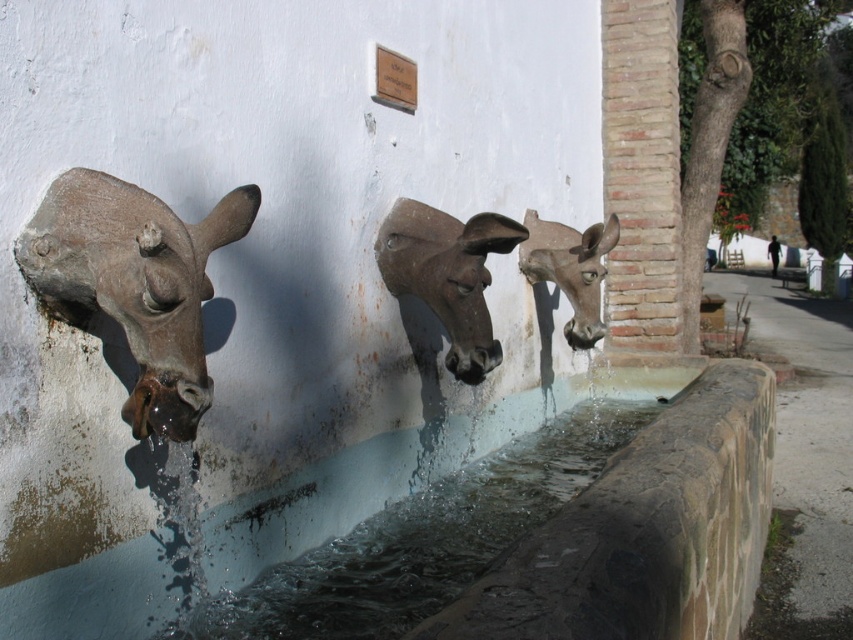
You are standing in front of the water fountain and want to touch both points on the wall. Which point, point [572,412] or point [26,282], will you reach first?

You will reach point [572,412] first because it is closer to you than point [26,282], which is further away.

You are standing in front of the fountain and want to place a small plant between the matte brown stone cow head at left and the rustic stone donkey head at center. Based on their positions, where should you place the plant?

The matte brown stone cow head at left is below rustic stone donkey head at center, so you should place the plant between them horizontally at the same level as the cow head since it is lower than the donkey head.